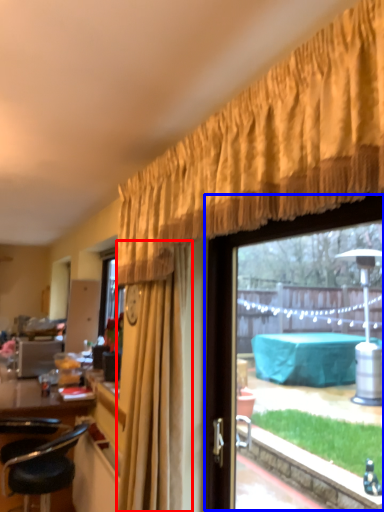
Question: Which object is further to the camera taking this photo, curtain (highlighted by a red box) or window (highlighted by a blue box)?

Choices:
 (A) curtain
 (B) window

Answer: (A)